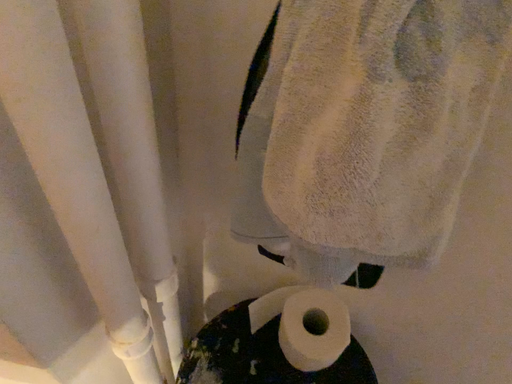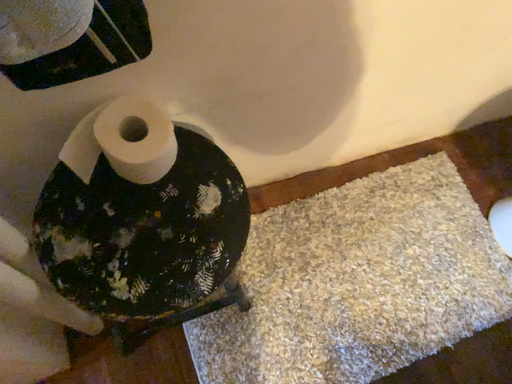
Question: How did the camera likely rotate when shooting the video?

Choices:
 (A) rotated right
 (B) rotated left

Answer: (A)